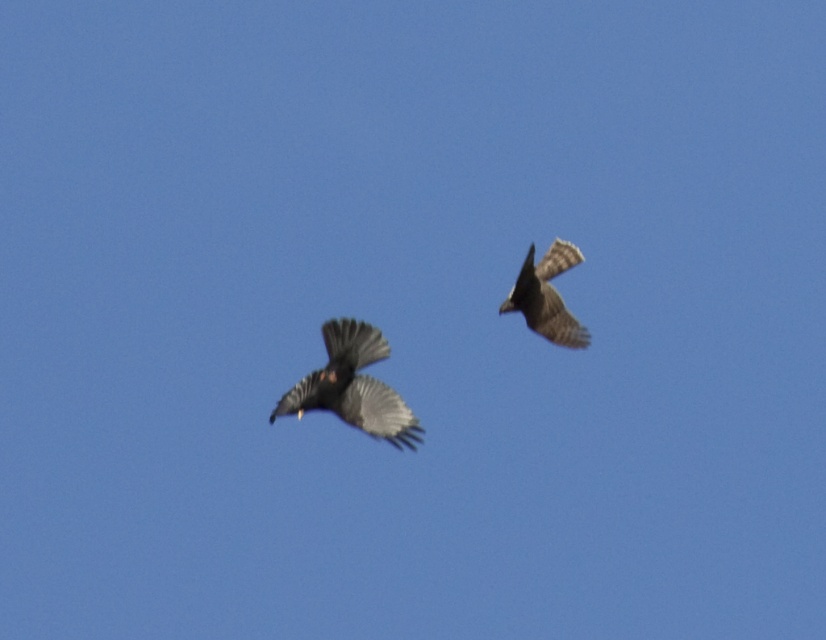
Consider the image. You are an ornithologist observing two birds in the sky. You see the matte black crow at center and the dark gray feathers at upper right. Which bird is positioned to the left of the other?

The matte black crow at center is positioned to the left of the dark gray feathers at upper right.

Looking at this image, you are an ornithologist observing birds in flight. You notice a matte black crow at center. Based on its coordinates at point 0.605, 0.427, can you determine its position relative to the image center?

The matte black crow at center is positioned at coordinates (x=352, y=387), which places it slightly to the right and below the image center.